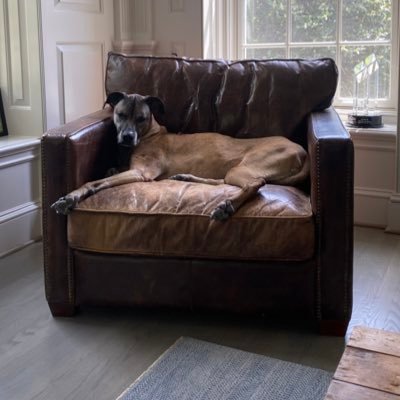
Image resolution: width=400 pixels, height=400 pixels. I want to click on front of chair, so click(169, 292).